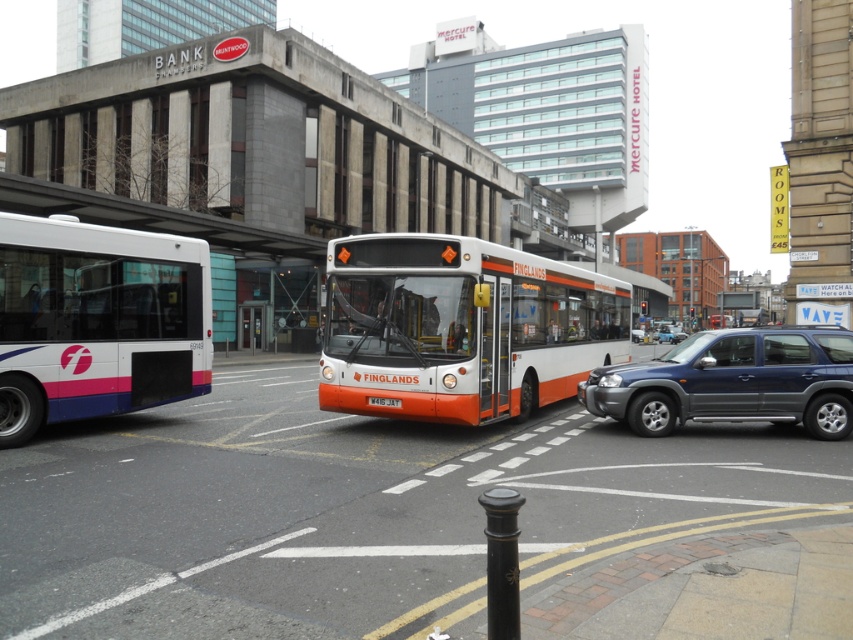
Is metallic blue suv at center closer to the viewer compared to white plastic license plate at center?

That is False.

Between metallic blue suv at center and white plastic license plate at center, which one has less height?

white plastic license plate at center

Is point (634, 385) farther from viewer compared to point (390, 397)?

Yes, it is.

You are a GUI agent. You are given a task and a screenshot of the screen. Output one action in this format:
    pyautogui.click(x=<x>, y=<y>)
    Task: Click on the metallic blue suv at center
    
    Given the screenshot: What is the action you would take?
    pyautogui.click(x=733, y=381)

Is the position of black polished metal pole at center more distant than that of white plastic license plate at center?

No, it is in front of white plastic license plate at center.

This screenshot has width=853, height=640. What are the coordinates of `black polished metal pole at center` in the screenshot? It's located at (502, 561).

Looking at this image, is orange matte bus at center positioned in front of white matte bus at left?

No, it is not.

Can you confirm if orange matte bus at center is positioned to the right of white matte bus at left?

Yes, orange matte bus at center is to the right of white matte bus at left.

Find the location of `orange matte bus at center`. orange matte bus at center is located at coordinates click(460, 326).

You are a GUI agent. You are given a task and a screenshot of the screen. Output one action in this format:
    pyautogui.click(x=<x>, y=<y>)
    Task: Click on the orange matte bus at center
    This screenshot has height=640, width=853.
    Given the screenshot: What is the action you would take?
    pyautogui.click(x=460, y=326)